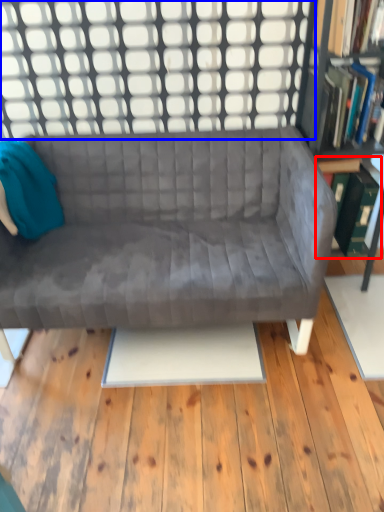
Question: Which object is closer to the camera taking this photo, shelf (highlighted by a red box) or window (highlighted by a blue box)?

Choices:
 (A) shelf
 (B) window

Answer: (B)